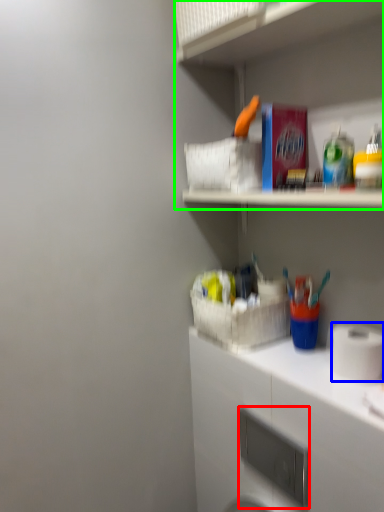
Question: Which object is positioned farthest from appliance (highlighted by a red box)? Select from toilet paper (highlighted by a blue box) and shelf (highlighted by a green box).

Choices:
 (A) toilet paper
 (B) shelf

Answer: (B)